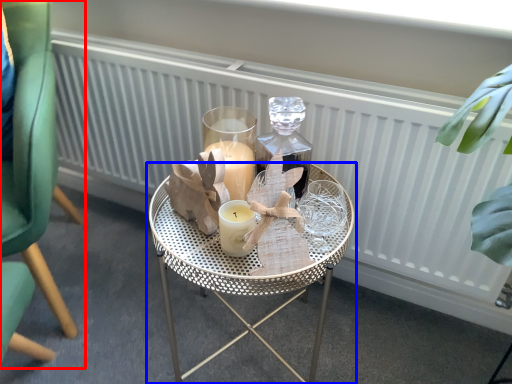
Question: Which object is further to the camera taking this photo, chair (highlighted by a red box) or table (highlighted by a blue box)?

Choices:
 (A) chair
 (B) table

Answer: (B)